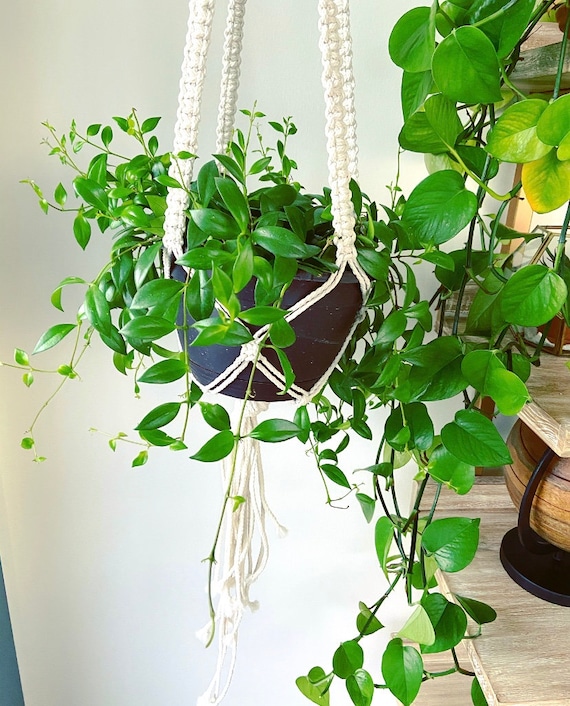
You are a GUI agent. You are given a task and a screenshot of the screen. Output one action in this format:
    pyautogui.click(x=<x>, y=<y>)
    Task: Click on the wooden bowl
    
    Given the screenshot: What is the action you would take?
    pyautogui.click(x=556, y=508)